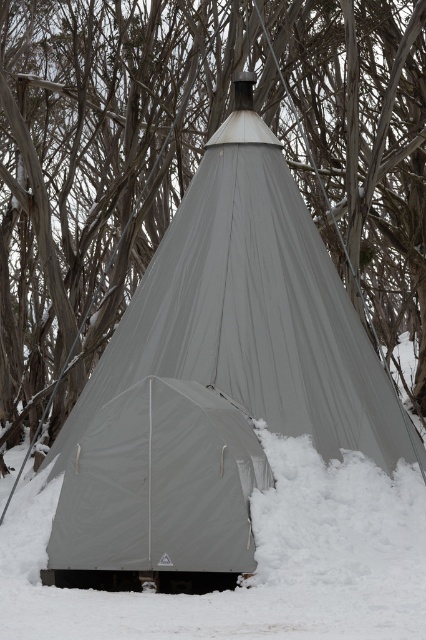
Who is more forward, [118,228] or [141,390]?

Point [141,390] is in front.

Is point (365, 257) positioned before point (170, 381)?

That is False.

Locate an element on the screen. This screenshot has height=640, width=426. gray fabric tent at center is located at coordinates (187, 154).